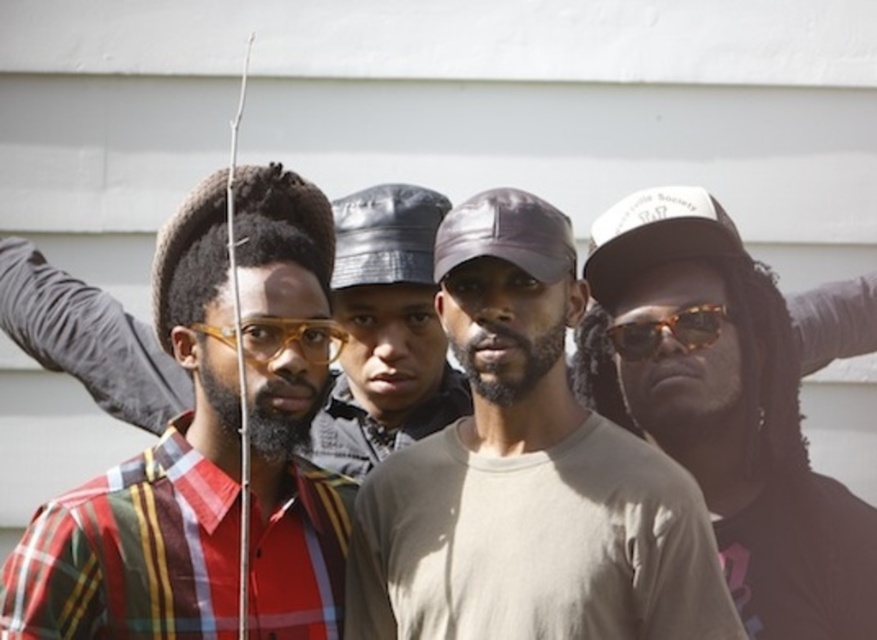
You are a photographer trying to capture a group photo of the matte gray cap at center and the matte black cap at center. Based on their positions, which cap should you focus on first if you want to ensure both are in the frame without moving the camera?

The matte gray cap at center is located below the matte black cap at center, so you should focus on the matte black cap at center first to ensure both are in the frame without moving the camera.

You are a photographer taking a group photo of the four people. You notice the white matte baseball cap at center and the matte black baseball cap at center. Which cap should you adjust to ensure both are clearly visible in the photo?

The white matte baseball cap at center is further to the viewer than the matte black baseball cap at center, so you should adjust the matte black baseball cap at center to ensure both are clearly visible in the photo.